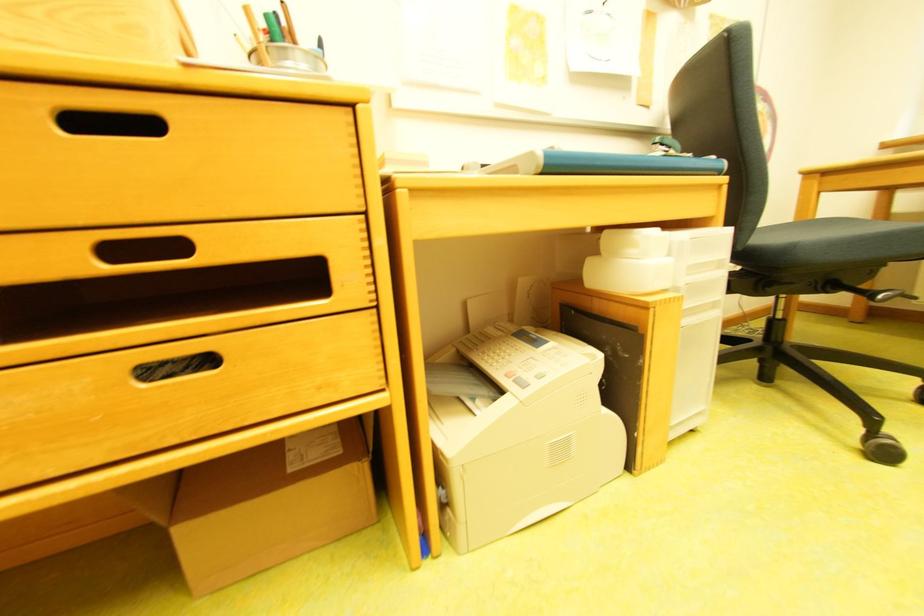
Image resolution: width=924 pixels, height=616 pixels. What do you see at coordinates (871, 302) in the screenshot?
I see `a chair adjustment lever` at bounding box center [871, 302].